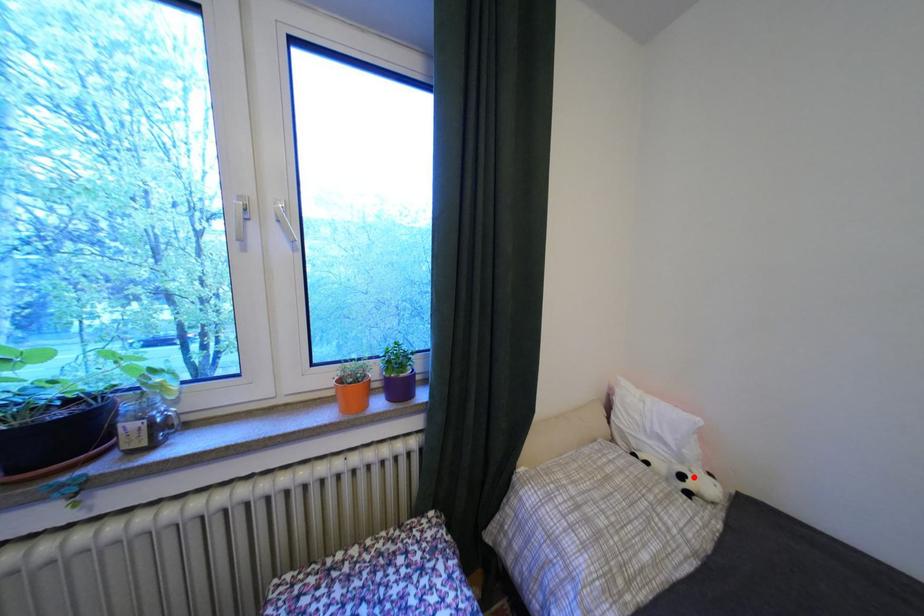
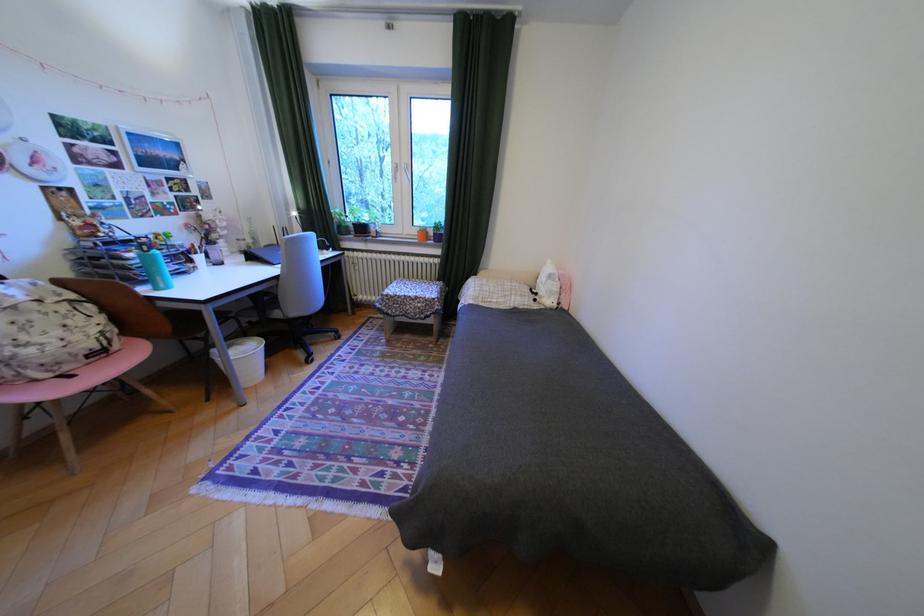
The point at the highlighted location is marked in the first image. Where is the corresponding point in the second image?

(548, 294)